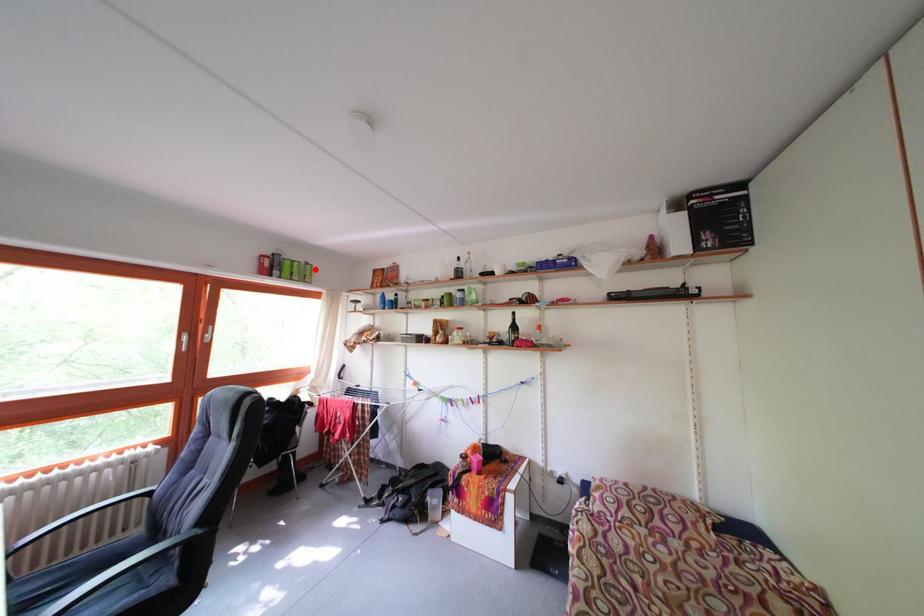
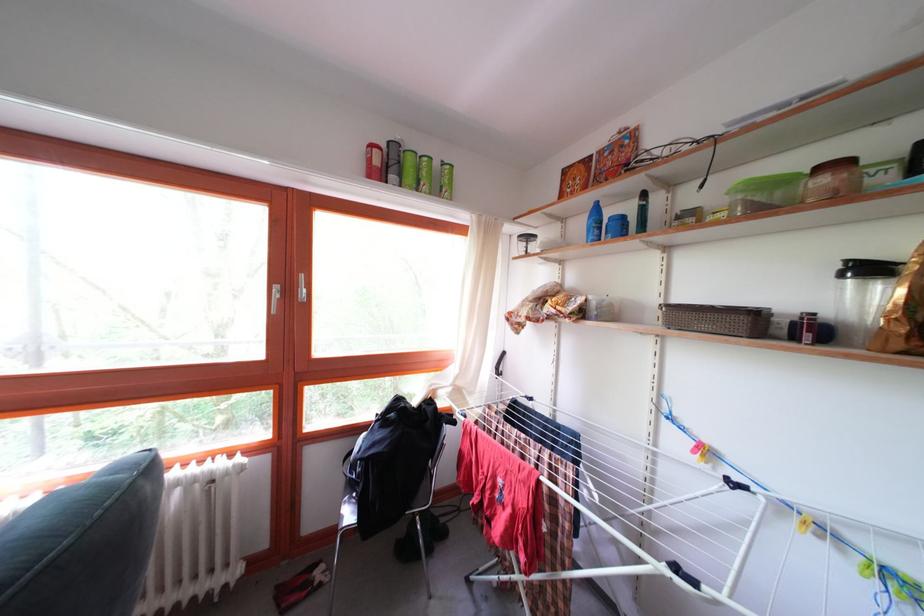
Question: I am providing you with two images of the same scene from different viewpoints. A red point is shown in image1. For the corresponding object point in image2, is it positioned nearer or farther from the camera?

Choices:
 (A) Nearer
 (B) Farther

Answer: (A)